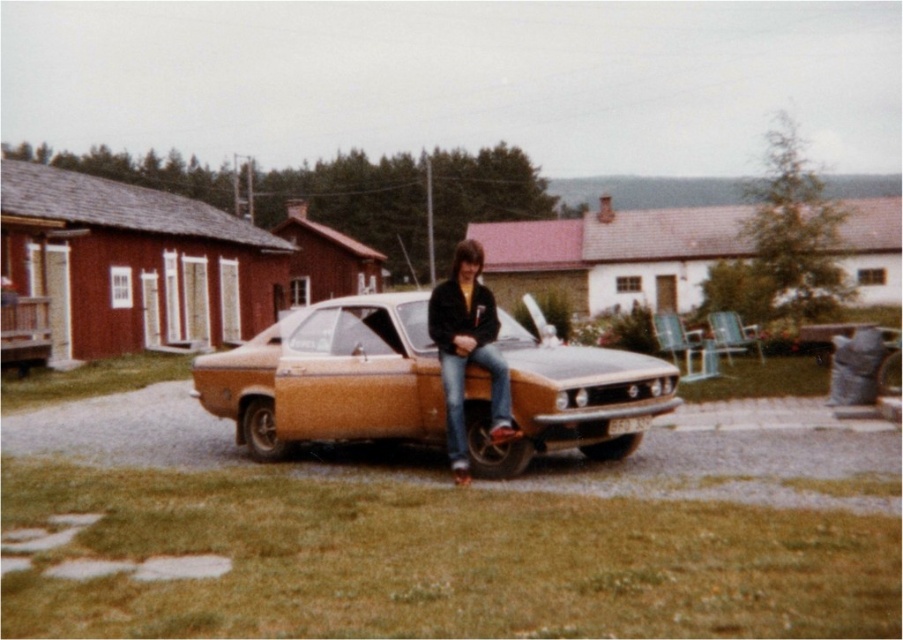
Consider the image. You are a photographer trying to capture a photo of the matte orange car at center and the jeans at center. If you want to ensure both subjects are in focus, which one should you focus on first, the one closer to you or the one further away?

The matte orange car at center is positioned under jeans at center, meaning the jeans are closer to you. To ensure both are in focus, you should focus on the jeans at center first since it is closer, and the car will be in focus as it is behind.

You are standing in the middle of the driveway and want to take a photo of the matte orange car at center and the jeans at center. Which object should you focus on first to ensure both are in the frame?

The matte orange car at center is in front of the jeans at center, so you should focus on the jeans at center first to ensure both are in the frame.